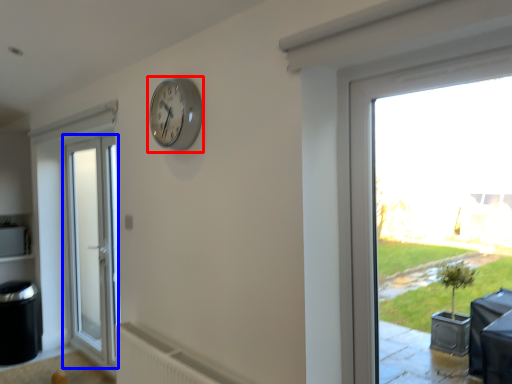
Question: Among these objects, which one is farthest to the camera, clock (highlighted by a red box) or door (highlighted by a blue box)?

Choices:
 (A) clock
 (B) door

Answer: (B)